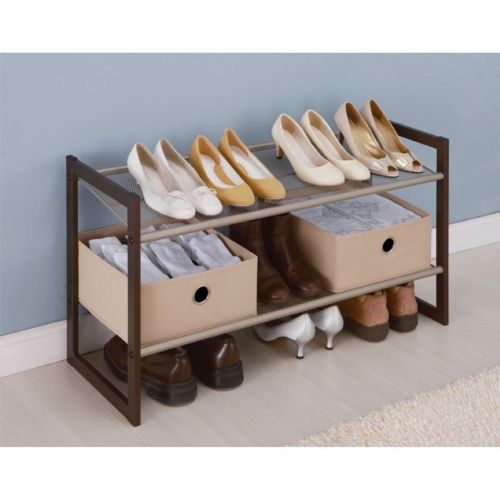
At what (x,y) coordinates should I click in order to perform the action: click on frame. Please return your answer as a coordinate pair (x, y). The image size is (500, 500). Looking at the image, I should click on (104, 187), (94, 380), (73, 300), (136, 307), (416, 142), (441, 228), (426, 309).